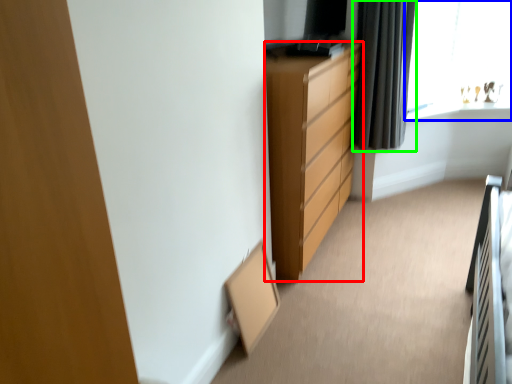
Question: Which object is positioned closest to chest of drawers (highlighted by a red box)? Select from window (highlighted by a blue box) and curtain (highlighted by a green box).

Choices:
 (A) window
 (B) curtain

Answer: (B)